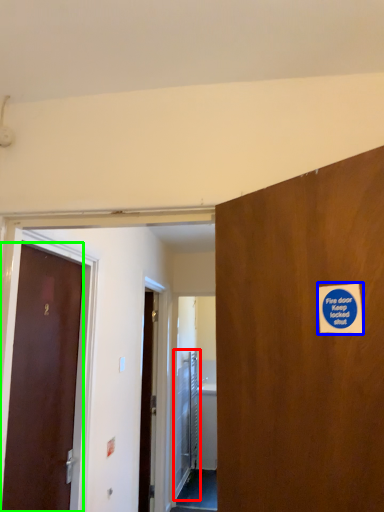
Question: Estimate the real-world distances between objects in this image. Which object is closer to elevator door (highlighted by a red box), sticker (highlighted by a blue box) or door (highlighted by a green box)?

Choices:
 (A) sticker
 (B) door

Answer: (B)